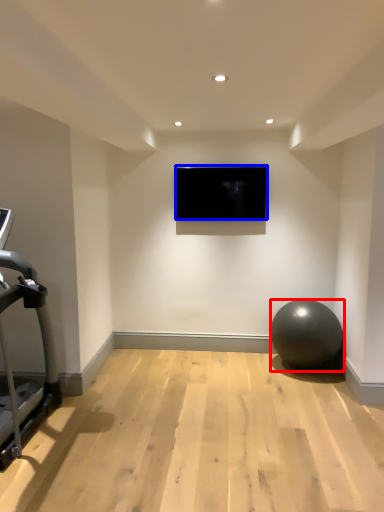
Question: Which object appears farthest to the camera in this image, ball (highlighted by a red box) or television (highlighted by a blue box)?

Choices:
 (A) ball
 (B) television

Answer: (B)